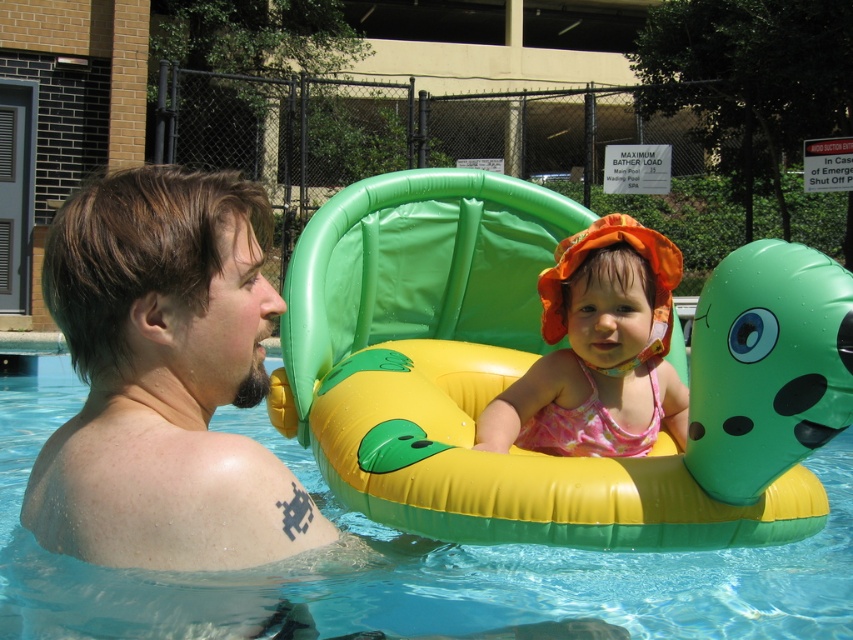
Question: Which point appears farthest from the camera in this image?

Choices:
 (A) pyautogui.click(x=59, y=508)
 (B) pyautogui.click(x=332, y=285)

Answer: (B)

Question: Can you confirm if smooth skin man at left is positioned to the right of transparent yellow-green float at center?

Choices:
 (A) yes
 (B) no

Answer: (B)

Question: Which point appears closest to the camera in this image?

Choices:
 (A) (225, 324)
 (B) (527, 378)
 (C) (514, 241)

Answer: (A)

Question: Is yellow rubber float at center wider than pink fabric swimsuit at center?

Choices:
 (A) yes
 (B) no

Answer: (A)

Question: Considering the relative positions of smooth skin man at left and transparent yellow-green float at center in the image provided, where is smooth skin man at left located with respect to transparent yellow-green float at center?

Choices:
 (A) right
 (B) left

Answer: (B)

Question: Which of the following is the closest to the observer?

Choices:
 (A) (796, 624)
 (B) (102, 214)
 (C) (357, 209)
 (D) (555, 372)

Answer: (B)